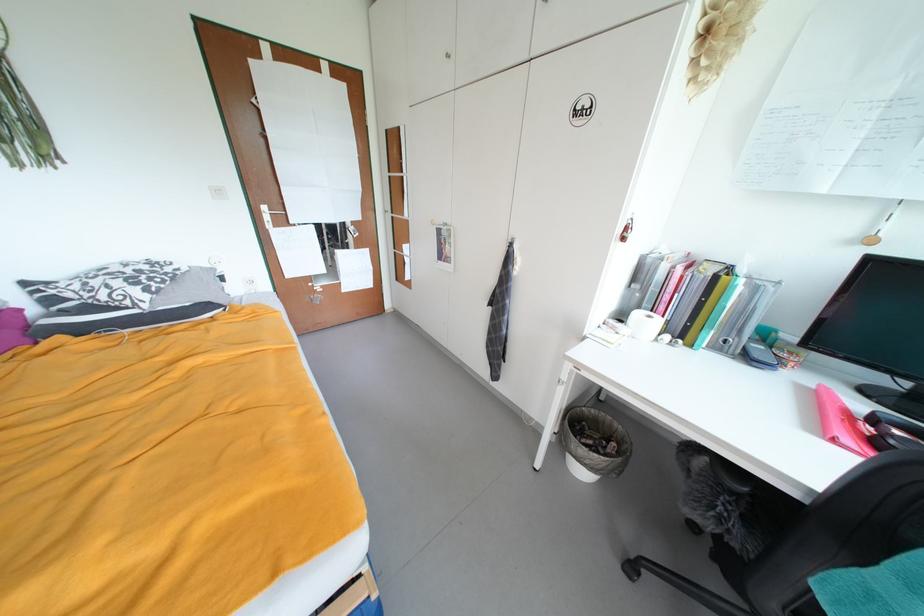
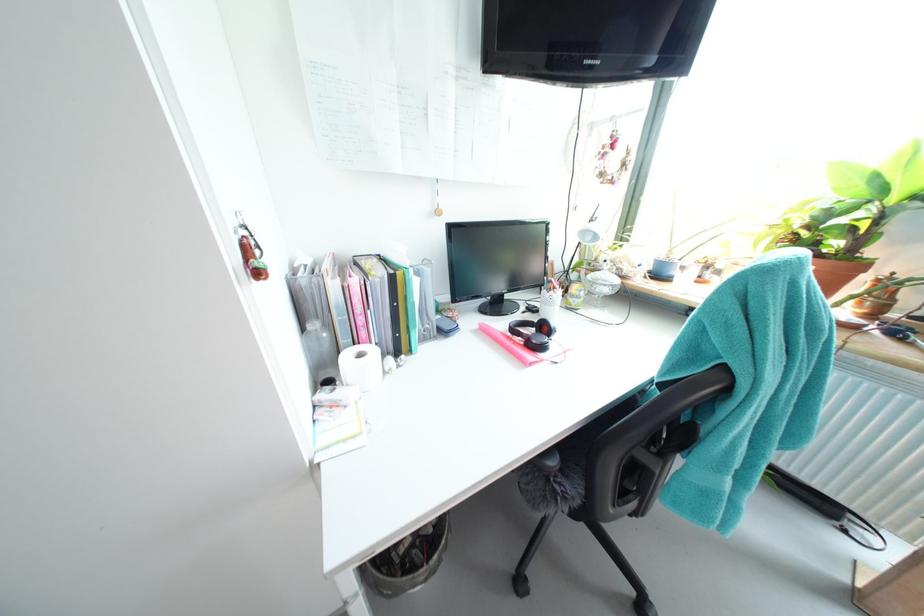
The images are taken continuously from a first-person perspective. In which direction is your viewpoint rotating?

The camera's rotation is toward right-down.